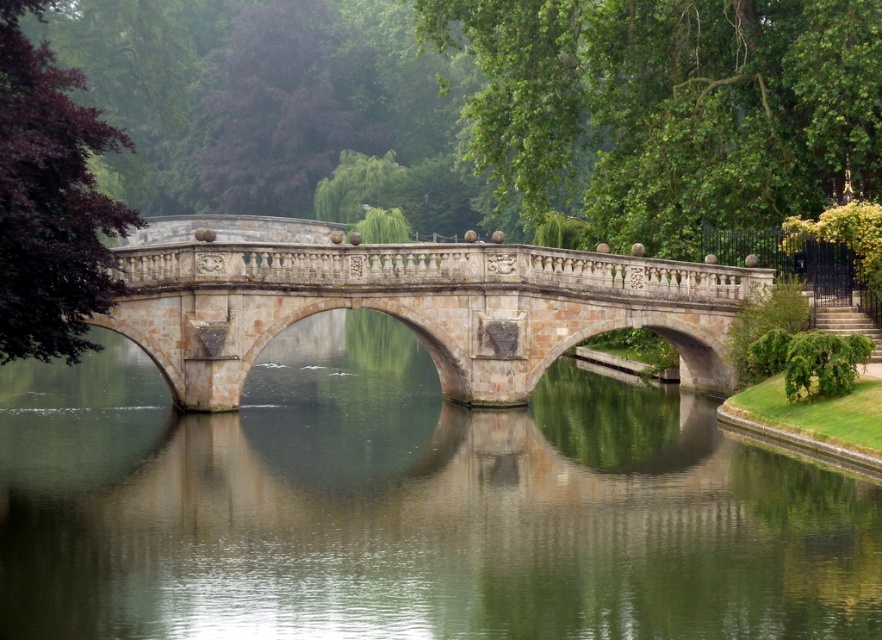
Does point (761, 451) come in front of point (294, 292)?

Yes, it is in front of point (294, 292).

Can you confirm if smooth stone water at center is wider than stone bridge at center?

Incorrect, smooth stone water at center's width does not surpass stone bridge at center's.

Locate an element on the screen. smooth stone water at center is located at coordinates (410, 506).

What are the coordinates of `smooth stone water at center` in the screenshot? It's located at (410, 506).